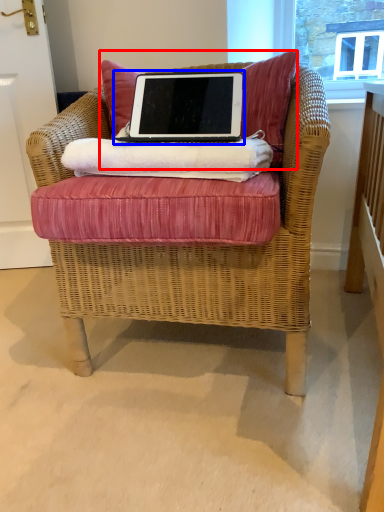
Question: Which point is closer to the camera, pillow (highlighted by a red box) or laptop (highlighted by a blue box)?

Choices:
 (A) pillow
 (B) laptop

Answer: (B)